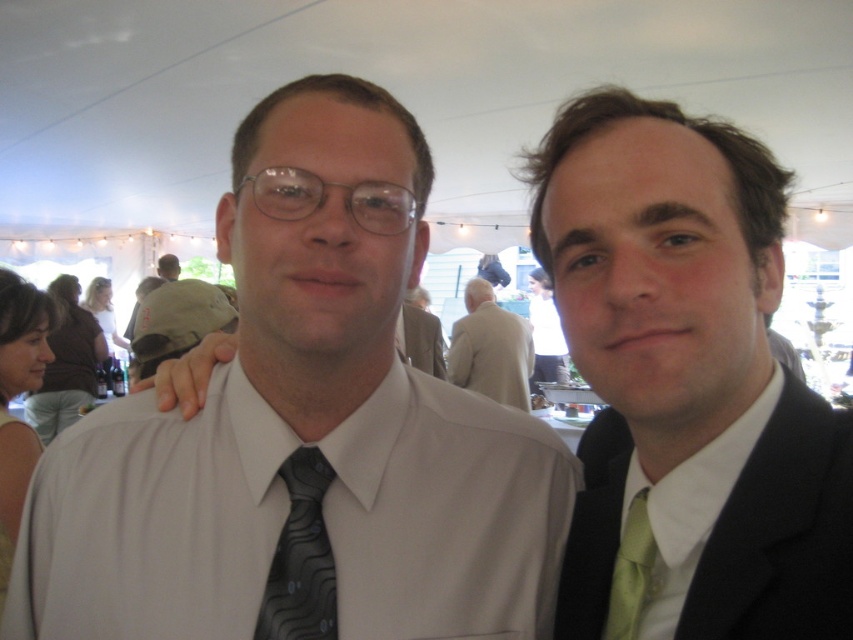
You are a photographer at an event and need to position two guests wearing the black matte suit at right and the light beige suit at center for a group photo. The venue has a limited space that can only accommodate one of them. Which suit wearer should you prioritize to fit into the space based on their clothing size?

The black matte suit at right has a smaller size compared to the light beige suit at center, so the guest wearing the black matte suit at right should be prioritized as they require less space.

You are a photographer at the event and need to adjust the lighting to focus on the green silk tie at center. Based on the coordinates provided, where should you position the light source relative to the tie?

The green silk tie at center is located at coordinates point (689, 376). To focus the lighting on it, position the light source directly in front of the tie at that coordinate point.

You are a photographer at the event and need to ensure that both the light beige suit at center and the matte khaki cap at left are fully visible in your photo. Given their sizes, which object will require more space in the frame?

The light beige suit at center is bigger than the matte khaki cap at left, so it will require more space in the frame to be fully visible.